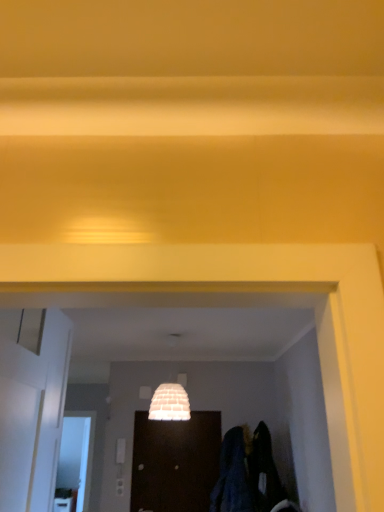
Question: Would you consider dark blue fabric at lower right to be distant from white glossy door at left, acting as the 2th door starting from the bottom?

Choices:
 (A) yes
 (B) no

Answer: (A)

Question: Is white glossy door at left, the 1th door when ordered from front to back, completely or partially inside dark blue fabric at lower right?

Choices:
 (A) no
 (B) yes

Answer: (A)

Question: From the image's perspective, is dark blue fabric at lower right below white glossy door at left, placed as the 1th door when sorted from top to bottom?

Choices:
 (A) no
 (B) yes

Answer: (B)

Question: From a real-world perspective, is dark blue fabric at lower right physically above white glossy door at left, acting as the 2th door starting from the bottom?

Choices:
 (A) yes
 (B) no

Answer: (B)

Question: Is dark blue fabric at lower right taller than white glossy door at left, acting as the 2th door starting from the bottom?

Choices:
 (A) no
 (B) yes

Answer: (A)

Question: From the image's perspective, is white glossy door at left, the 1th door when ordered from front to back, positioned above or below dark blue fabric at lower right?

Choices:
 (A) above
 (B) below

Answer: (A)

Question: Would you say white glossy door at left, the second door when ordered from right to left, is inside or outside dark blue fabric at lower right?

Choices:
 (A) inside
 (B) outside

Answer: (B)

Question: Is point (13, 370) closer or farther from the camera than point (246, 479)?

Choices:
 (A) farther
 (B) closer

Answer: (B)

Question: Is white glossy door at left, placed as the 1th door when sorted from top to bottom, in front of or behind dark blue fabric at lower right in the image?

Choices:
 (A) front
 (B) behind

Answer: (A)

Question: Does point (8, 366) appear closer or farther from the camera than point (145, 488)?

Choices:
 (A) closer
 (B) farther

Answer: (A)

Question: Would you say white glossy door at left, the first door from the left, is to the left or to the right of dark wood door at center, the first door from the back, in the picture?

Choices:
 (A) right
 (B) left

Answer: (B)

Question: In terms of height, does white glossy door at left, the 1th door when ordered from front to back, look taller or shorter compared to dark wood door at center, marked as the 2th door in a left-to-right arrangement?

Choices:
 (A) tall
 (B) short

Answer: (A)

Question: From a real-world perspective, is white glossy door at left, the second door when ordered from right to left, physically located above or below dark wood door at center, the first door from the back?

Choices:
 (A) above
 (B) below

Answer: (A)

Question: In terms of width, does dark blue fabric at lower right look wider or thinner when compared to white glossy door at left, placed as the 1th door when sorted from top to bottom?

Choices:
 (A) thin
 (B) wide

Answer: (B)

Question: Is dark blue fabric at lower right in front of or behind white glossy door at left, the 1th door when ordered from front to back, in the image?

Choices:
 (A) front
 (B) behind

Answer: (B)